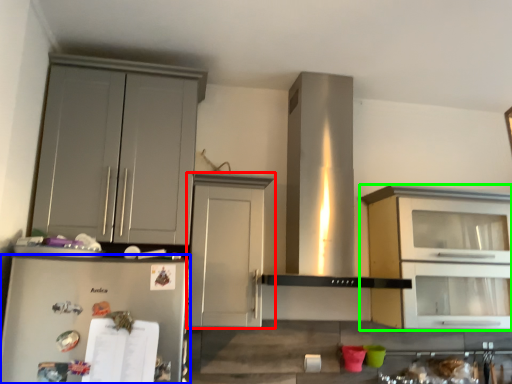
Question: Which object is positioned closest to cabinetry (highlighted by a red box)? Select from refrigerator (highlighted by a blue box) and cabinetry (highlighted by a green box).

Choices:
 (A) refrigerator
 (B) cabinetry

Answer: (A)